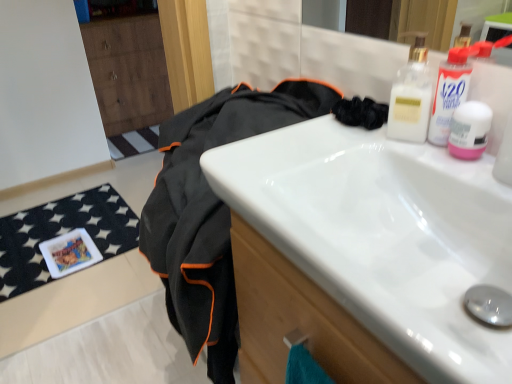
In order to face black fabric at center, should I rotate leftwards or rightwards?

Turn left by 5.166 degrees to look at black fabric at center.

This screenshot has width=512, height=384. What do you see at coordinates (211, 211) in the screenshot?
I see `black fabric at center` at bounding box center [211, 211].

Find the location of `black fabric at center`. black fabric at center is located at coordinates (211, 211).

This screenshot has width=512, height=384. In order to click on white glossy sink at center in this screenshot , I will do `click(365, 253)`.

What is the approximate width of white glossy sink at center?

The width of white glossy sink at center is 13.27 inches.

This screenshot has height=384, width=512. What do you see at coordinates (365, 253) in the screenshot?
I see `white glossy sink at center` at bounding box center [365, 253].

Find the location of a particular element. Image resolution: width=512 pixels, height=384 pixels. black fabric at center is located at coordinates (211, 211).

Does white glossy sink at center appear on the left side of black fabric at center?

Incorrect, white glossy sink at center is not on the left side of black fabric at center.

Relative to black fabric at center, is white glossy sink at center in front or behind?

Clearly, white glossy sink at center is in front of black fabric at center.

Is point (375, 145) in front of point (183, 120)?

Yes, point (375, 145) is in front of point (183, 120).

From the image's perspective, which object appears higher, white glossy sink at center or black fabric at center?

white glossy sink at center appears higher in the image.

From a real-world perspective, is white glossy sink at center positioned above or below black fabric at center?

From a real-world perspective, white glossy sink at center is physically above black fabric at center.

In terms of width, does white glossy sink at center look wider or thinner when compared to black fabric at center?

white glossy sink at center is thinner than black fabric at center.

From their relative heights in the image, would you say white glossy sink at center is taller or shorter than black fabric at center?

Clearly, white glossy sink at center is shorter compared to black fabric at center.

Who is bigger, white glossy sink at center or black fabric at center?

black fabric at center.

Would you say white glossy sink at center contains black fabric at center?

Definitely not — black fabric at center is not inside white glossy sink at center.

Is white glossy sink at center not near black fabric at center?

No, white glossy sink at center is not far away from black fabric at center.

Is black fabric at center at the back of white glossy sink at center?

No.

Identify the location of clothing located on the left of white glossy sink at center. The width and height of the screenshot is (512, 384). (211, 211).

Based on their positions, is black fabric at center located to the left or right of white glossy sink at center?

black fabric at center is positioned on white glossy sink at center's left side.

Considering their positions, is black fabric at center located in front of or behind white glossy sink at center?

Clearly, black fabric at center is behind white glossy sink at center.

Is point (156, 193) in front of point (362, 269)?

No, it is not.

From the image's perspective, is black fabric at center located above white glossy sink at center?

Incorrect, from the image's perspective, black fabric at center is lower than white glossy sink at center.

From a real-world perspective, is black fabric at center located higher than white glossy sink at center?

Incorrect, from a real-world perspective, black fabric at center is lower than white glossy sink at center.

Between black fabric at center and white glossy sink at center, which one has smaller width?

With smaller width is white glossy sink at center.

Between black fabric at center and white glossy sink at center, which one has more height?

black fabric at center is taller.

Which of these two, black fabric at center or white glossy sink at center, is bigger?

black fabric at center is bigger.

Can white glossy sink at center be found inside black fabric at center?

No, white glossy sink at center is not inside black fabric at center.

Is black fabric at center not close to white glossy sink at center?

No.

Is black fabric at center turned away from white glossy sink at center?

No, black fabric at center's orientation is not away from white glossy sink at center.

How many degrees apart are the facing directions of black fabric at center and white glossy sink at center?

They differ by 0.285 degrees in their facing directions.

Where is `sink located in front of the black fabric at center`? This screenshot has width=512, height=384. sink located in front of the black fabric at center is located at coordinates click(365, 253).

Where is `clothing behind the white glossy sink at center`? The width and height of the screenshot is (512, 384). clothing behind the white glossy sink at center is located at coordinates (211, 211).

Identify the location of sink above the black fabric at center (from the image's perspective). The image size is (512, 384). (365, 253).